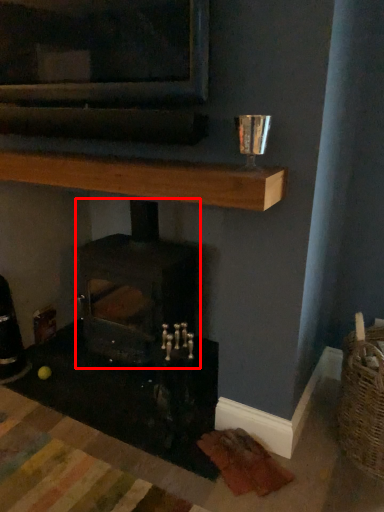
Question: From the image's perspective, what is the correct spatial relationship of wood burning stove (annotated by the red box) in relation to shelf?

Choices:
 (A) above
 (B) below

Answer: (B)